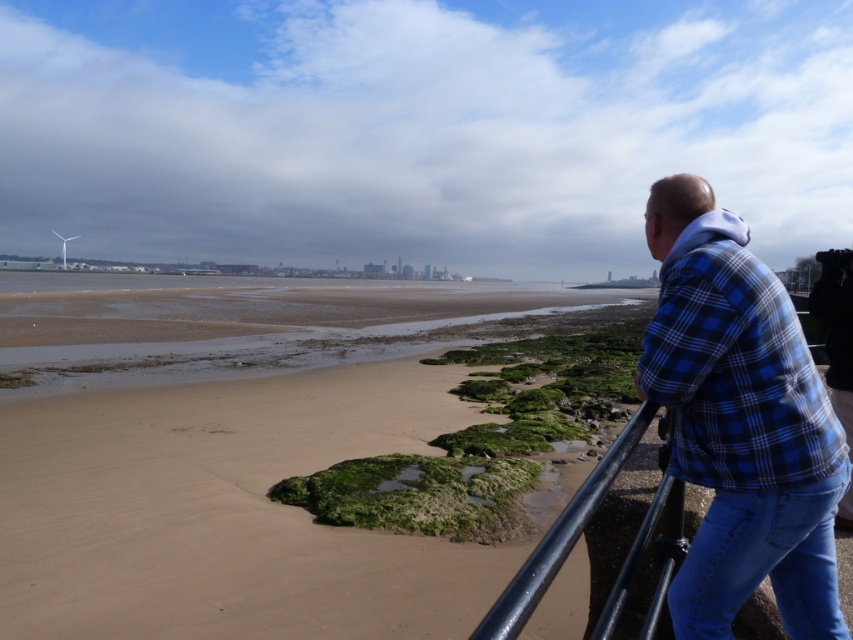
Question: Based on their relative distances, which object is farther from the sandy brown beach at lower left?

Choices:
 (A) blue denim jeans at lower right
 (B) blue plaid shirt at right

Answer: (B)

Question: Does blue plaid shirt at right have a lesser width compared to black metal rail at lower right?

Choices:
 (A) no
 (B) yes

Answer: (B)

Question: Where is blue plaid shirt at right located in relation to black metal rail at lower right in the image?

Choices:
 (A) below
 (B) above

Answer: (B)

Question: Does sandy brown beach at lower left appear on the right side of black metal rail at lower right?

Choices:
 (A) no
 (B) yes

Answer: (A)

Question: Which object is positioned farthest from the sandy brown beach at lower left?

Choices:
 (A) blue denim jeans at lower right
 (B) black metal rail at lower right

Answer: (B)

Question: Which of the following is the farthest from the observer?

Choices:
 (A) blue plaid shirt at right
 (B) sandy brown beach at lower left

Answer: (B)